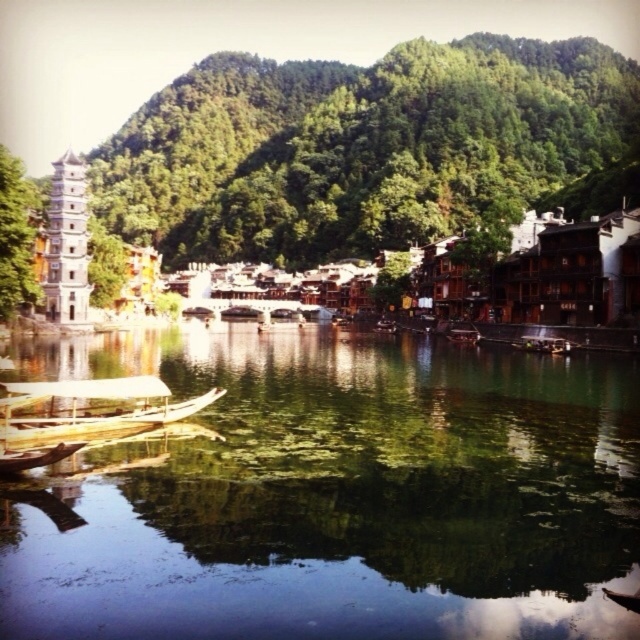
You are standing on the riverside and want to take a photo of both the green reflective water at center and the white stone tower at left. Which object should you focus on first to ensure both are in the frame?

You should focus on the green reflective water at center first because it is closer to the viewer than the white stone tower at left, so adjusting the camera to include it will also capture the tower in the background.

Consider the image. You are a tourist standing on the riverside path and want to take a photo of both the wooden boat at lower left and the wooden boat at center. Which boat should you move closer to in order to capture both in the same frame without moving your position?

You should move closer to the wooden boat at center because the wooden boat at lower left is in front of it, so positioning yourself closer to the one further back will help include both in the frame.

You are a tourist standing on the riverside path. You want to take a photo that includes both the green reflective water at center and the white stone tower at left. Which object should you position closer to the foreground to ensure both are in focus?

To ensure both the green reflective water at center and the white stone tower at left are in focus, position the white stone tower at left closer to the foreground since it has a greater height than the green reflective water at center.